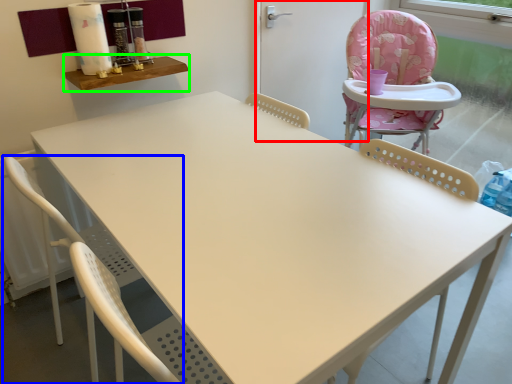
Question: Based on their relative distances, which object is farther from screen door (highlighted by a red box)? Choose from chair (highlighted by a blue box) and table (highlighted by a green box).

Choices:
 (A) chair
 (B) table

Answer: (A)